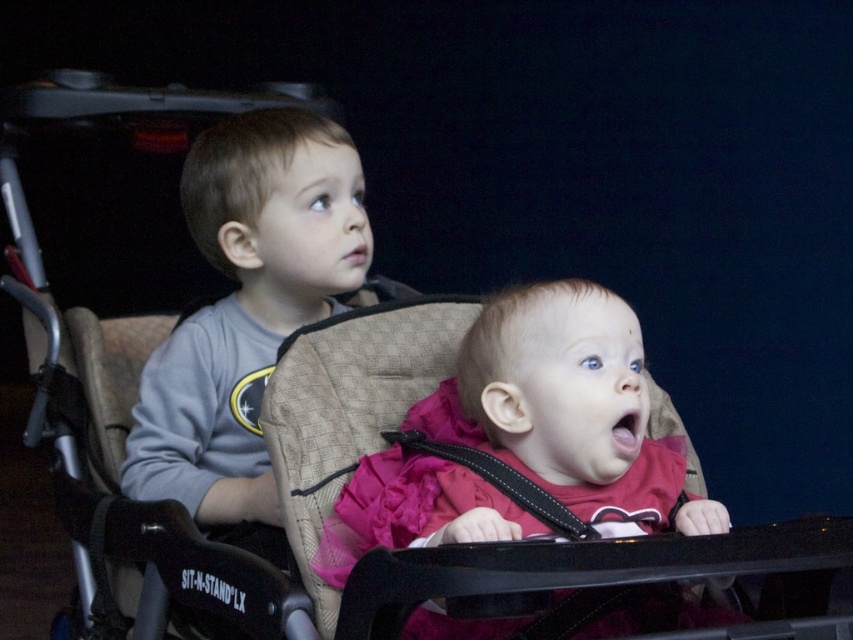
Measure the distance between pink satin dress at center and black leather strap at center.

4.37 inches

Who is taller, pink satin dress at center or black leather strap at center?

pink satin dress at center

Locate an element on the screen. The image size is (853, 640). pink satin dress at center is located at coordinates (561, 404).

Image resolution: width=853 pixels, height=640 pixels. What are the coordinates of `gray cotton shirt at left` in the screenshot? It's located at (247, 305).

Is gray cotton shirt at left taller than black leather strap at center?

Yes, gray cotton shirt at left is taller than black leather strap at center.

This screenshot has height=640, width=853. What are the coordinates of `gray cotton shirt at left` in the screenshot? It's located at (247, 305).

Identify the location of gray cotton shirt at left. This screenshot has width=853, height=640. (247, 305).

Between pink satin dress at center and gray cotton shirt at left, which one is positioned lower?

pink satin dress at center

Does point (654, 490) come closer to viewer compared to point (254, 515)?

Yes, it is.

What are the coordinates of `pink satin dress at center` in the screenshot? It's located at (561, 404).